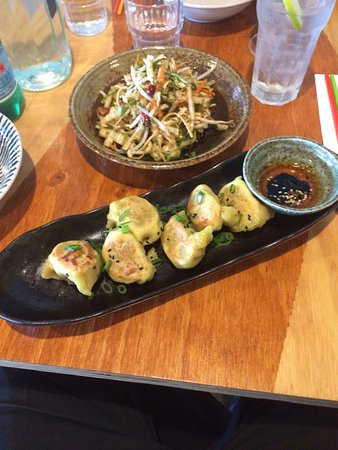
This screenshot has height=450, width=338. I want to click on water glass with lemon wedge on it, so click(x=291, y=61).